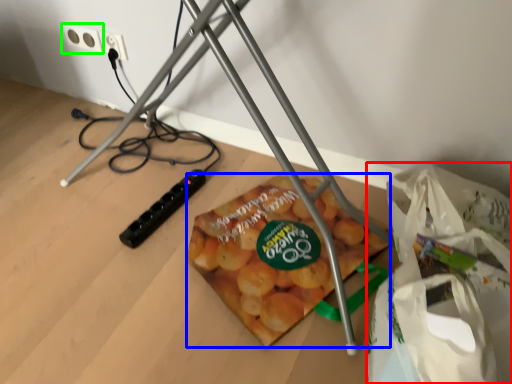
Question: Which object is the closest to the shopping bag (highlighted by a red box)? Choose among these: snack (highlighted by a blue box) or power plugs and sockets (highlighted by a green box).

Choices:
 (A) snack
 (B) power plugs and sockets

Answer: (A)